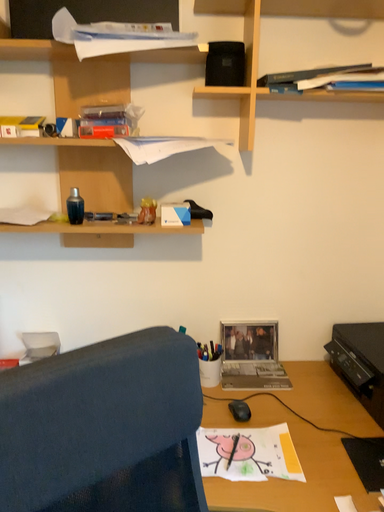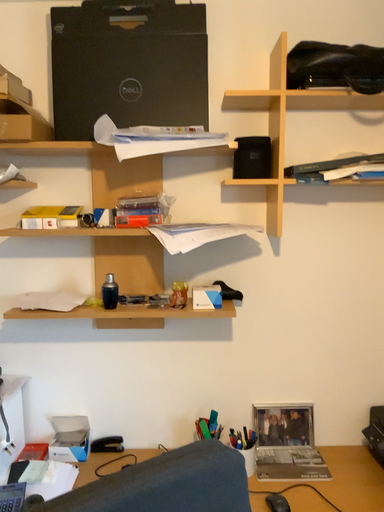
Question: How did the camera likely rotate when shooting the video?

Choices:
 (A) rotated downward
 (B) rotated upward

Answer: (B)